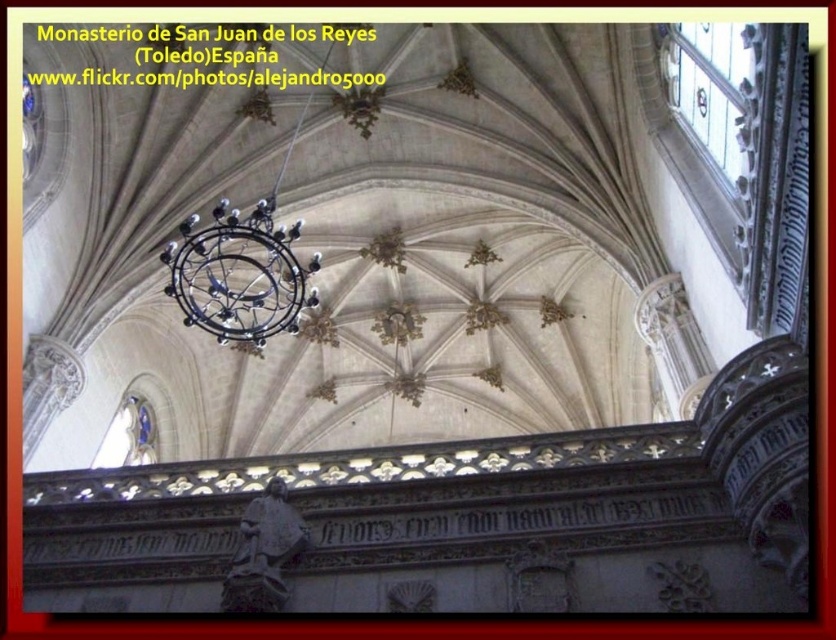
Is point (190, 301) farther from camera compared to point (284, 497)?

Yes, point (190, 301) is farther from viewer.

Is black wrought iron chandelier at center taller than dark gray stone statue at lower center?

Yes, black wrought iron chandelier at center is taller than dark gray stone statue at lower center.

Where is `black wrought iron chandelier at center`? black wrought iron chandelier at center is located at coordinates (238, 275).